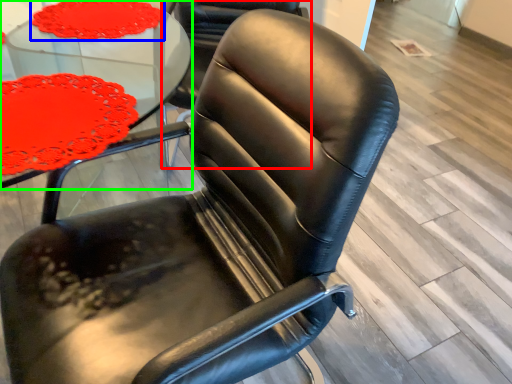
Question: Which object is positioned farthest from chair (highlighted by a red box)? Select from tablecloth (highlighted by a blue box) and table (highlighted by a green box).

Choices:
 (A) tablecloth
 (B) table

Answer: (A)